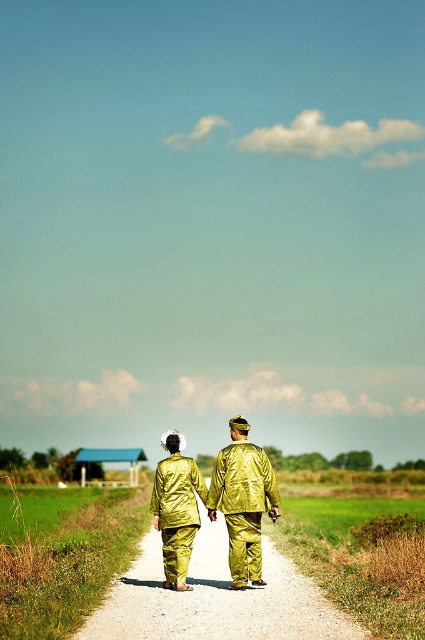
Looking at this image, you are an artist trying to paint the scene. You notice two shiny gold items at the center of the image. Which one is taller between the gold shiny pants at center and the shiny gold trench coat at center?

The gold shiny pants at center is taller than the shiny gold trench coat at center.

Based on the photo, you are a photographer setting up a camera to capture the two figures in the scene. You notice the gold shiny pants at center and the shiny gold trench coat at center. Which of these items might have a larger width when viewed from your camera angle?

The gold shiny pants at center might be wider than the shiny gold trench coat at center, so the gold shiny pants at center could appear wider in the photo.